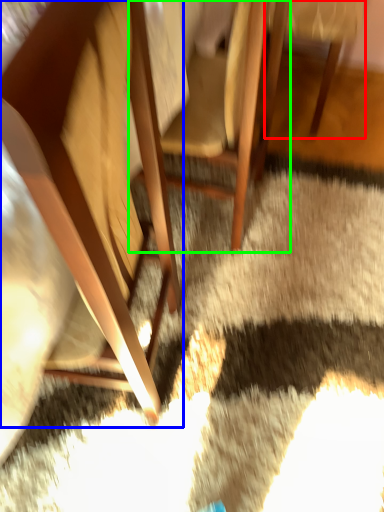
Question: Considering the real-world distances, which object is farthest from chair (highlighted by a red box)? chair (highlighted by a blue box) or chair (highlighted by a green box)?

Choices:
 (A) chair
 (B) chair

Answer: (A)